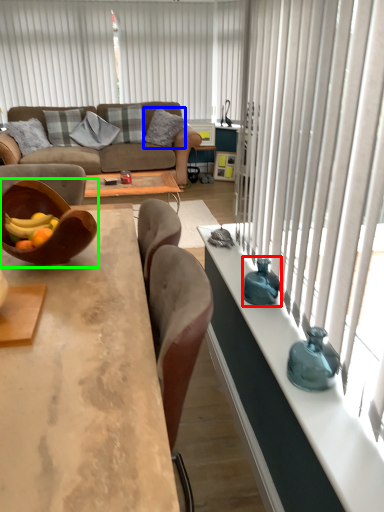
Question: Based on their relative distances, which object is farther from vase (highlighted by a red box)? Choose from pillow (highlighted by a blue box) and bowl (highlighted by a green box).

Choices:
 (A) pillow
 (B) bowl

Answer: (A)